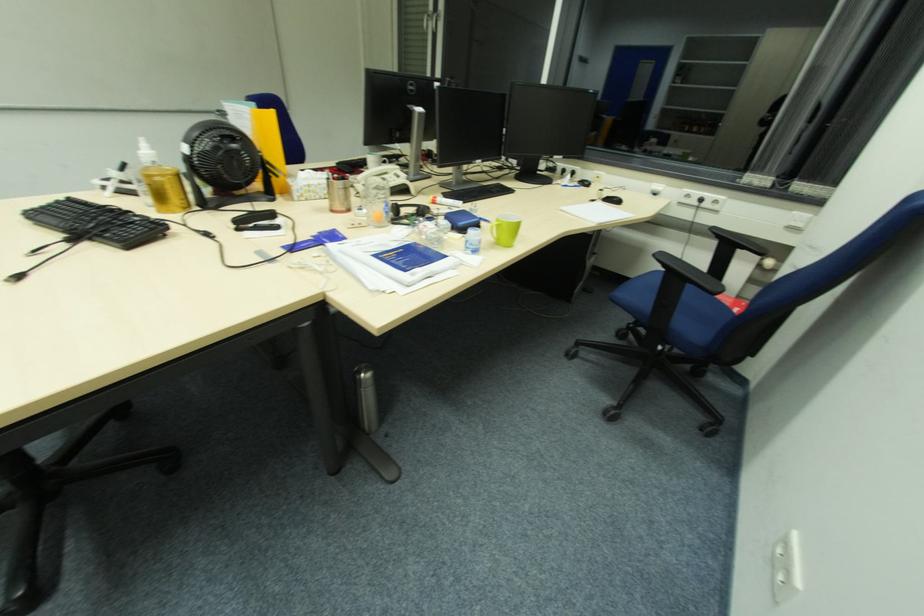
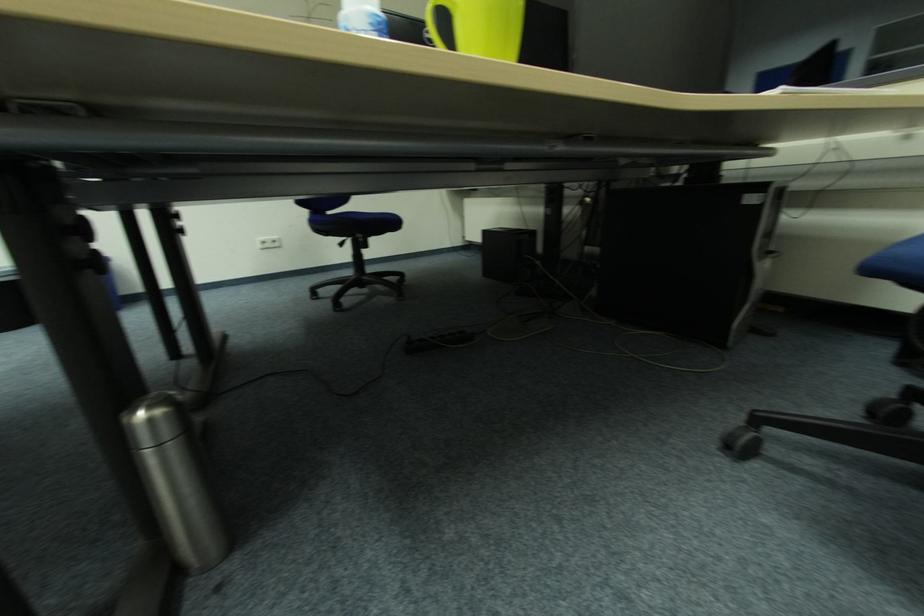
Question: The images are taken continuously from a first-person perspective. In which direction are you moving?

Choices:
 (A) Left
 (B) Right
 (C) Forward
 (D) Backward

Answer: (C)